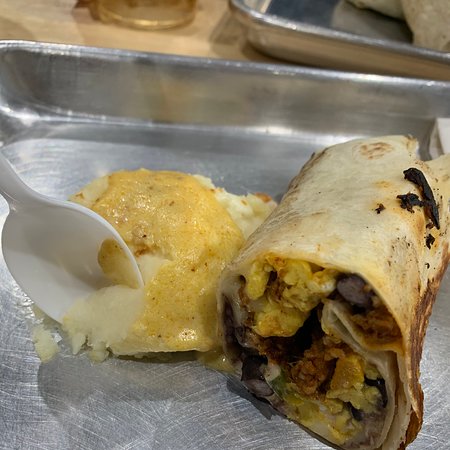
You are a GUI agent. You are given a task and a screenshot of the screen. Output one action in this format:
    pyautogui.click(x=<x>, y=<y>)
    Task: Click on the pans
    Image resolution: width=450 pixels, height=450 pixels.
    Given the screenshot: What is the action you would take?
    pyautogui.click(x=295, y=83), pyautogui.click(x=316, y=42)